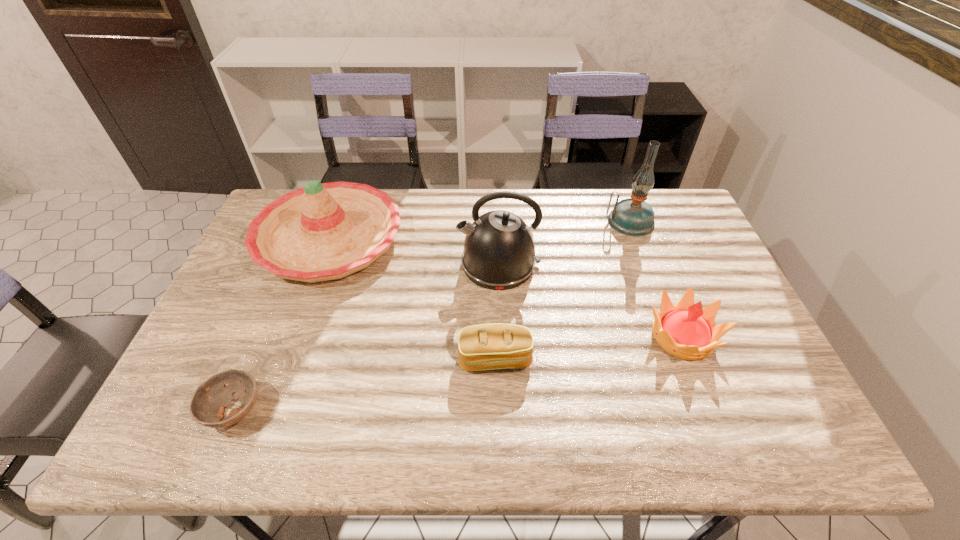
This screenshot has height=540, width=960. I want to click on object that can be found as the second closest to the oil lamp, so click(685, 330).

The image size is (960, 540). Find the location of `the closest object to the third shortest object`. the closest object to the third shortest object is located at coordinates (499, 253).

At what (x,y) coordinates should I click in order to perform the action: click on free space that satisfies the following two spatial constraints: 1. on the spout of the kettle; 2. on the zipper side of the fifth tallest object. Please return your answer as a coordinate pair (x, y). This screenshot has width=960, height=540. Looking at the image, I should click on (503, 359).

Identify the location of vacant space that satisfies the following two spatial constraints: 1. on the front side of the crown; 2. on the right side of the sombrero. (294, 336).

Where is `free spot that satisfies the following two spatial constraints: 1. on the back side of the nearest object; 2. on the right side of the crown`? This screenshot has height=540, width=960. free spot that satisfies the following two spatial constraints: 1. on the back side of the nearest object; 2. on the right side of the crown is located at coordinates (265, 336).

The image size is (960, 540). Identify the location of vacant space that satisfies the following two spatial constraints: 1. on the spout of the kettle; 2. on the zipper side of the second shortest object. (x=503, y=359).

Locate an element on the screen. vacant space that satisfies the following two spatial constraints: 1. on the front side of the oil lamp; 2. on the right side of the fourth tallest object is located at coordinates (672, 336).

Where is `blank space that satisfies the following two spatial constraints: 1. on the spout of the kettle; 2. on the zipper side of the clutch bag`? The height and width of the screenshot is (540, 960). blank space that satisfies the following two spatial constraints: 1. on the spout of the kettle; 2. on the zipper side of the clutch bag is located at coordinates pyautogui.click(x=503, y=359).